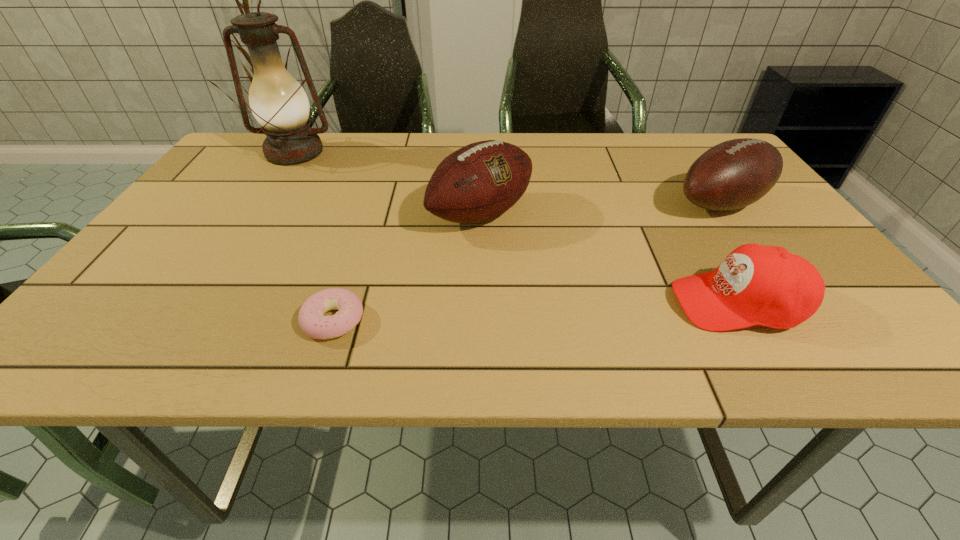
Where is `the farthest object`? The height and width of the screenshot is (540, 960). the farthest object is located at coordinates click(x=278, y=102).

You are a GUI agent. You are given a task and a screenshot of the screen. Output one action in this format:
    pyautogui.click(x=<x>, y=<y>)
    Task: Click on the oil lamp
    
    Given the screenshot: What is the action you would take?
    pyautogui.click(x=278, y=102)

You are a GUI agent. You are given a task and a screenshot of the screen. Output one action in this format:
    pyautogui.click(x=<x>, y=<y>)
    Task: Click on the third object from right to left
    The image size is (960, 540).
    Given the screenshot: What is the action you would take?
    pyautogui.click(x=480, y=181)

Find the location of `the right football (American)`. the right football (American) is located at coordinates (736, 173).

Image resolution: width=960 pixels, height=540 pixels. Identify the location of the fourth tallest object. (762, 285).

Image resolution: width=960 pixels, height=540 pixels. What are the coordinates of `doughnut` in the screenshot? It's located at (312, 321).

Find the location of a particular element. The width and height of the screenshot is (960, 540). the shortest object is located at coordinates (312, 321).

Locate an element on the screen. vacant area situated on the right of the farthest object is located at coordinates (424, 152).

Identify the location of vacant space situated 0.190m on the right of the left football (American). (612, 214).

I want to click on free space located 0.050m on the left of the right football (American), so click(647, 204).